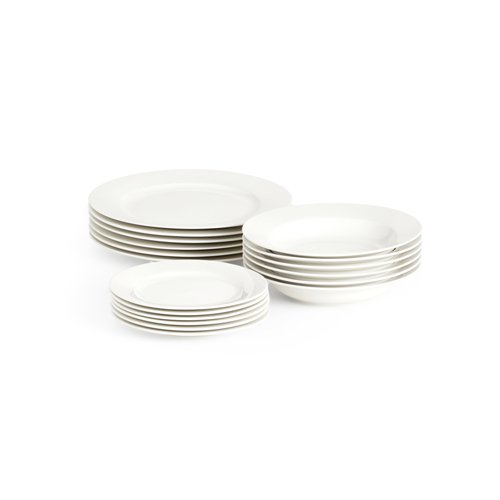
Identify the location of bowls. (334, 254), (334, 260), (334, 268), (334, 276), (334, 283), (334, 289).